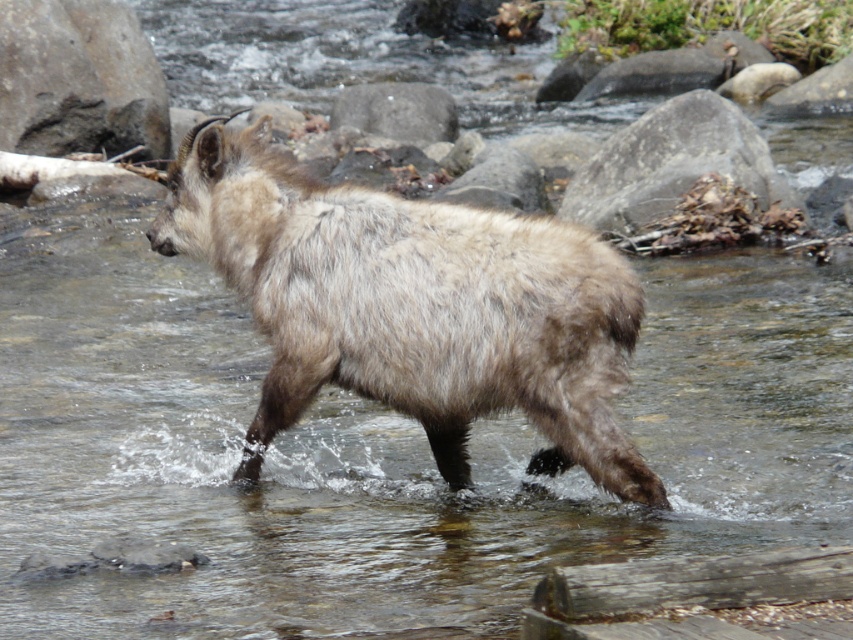
Question: Which point is farther to the camera?

Choices:
 (A) (387, 104)
 (B) (99, 147)

Answer: (A)

Question: In this image, where is fuzzy brown goat at center located relative to gray rock at center?

Choices:
 (A) above
 (B) below

Answer: (B)

Question: Is fuzzy brown goat at center thinner than gray rock at upper left?

Choices:
 (A) yes
 (B) no

Answer: (B)

Question: Is gray rough rock at upper center bigger than gray rock at center?

Choices:
 (A) no
 (B) yes

Answer: (B)

Question: Which object is positioned closest to the gray rock at center?

Choices:
 (A) fuzzy brown goat at center
 (B) gray rough rock at upper center
 (C) gray rock at upper left

Answer: (C)

Question: Which point is closer to the camera?

Choices:
 (A) (100, 58)
 (B) (653, 208)
 (C) (404, 99)

Answer: (B)